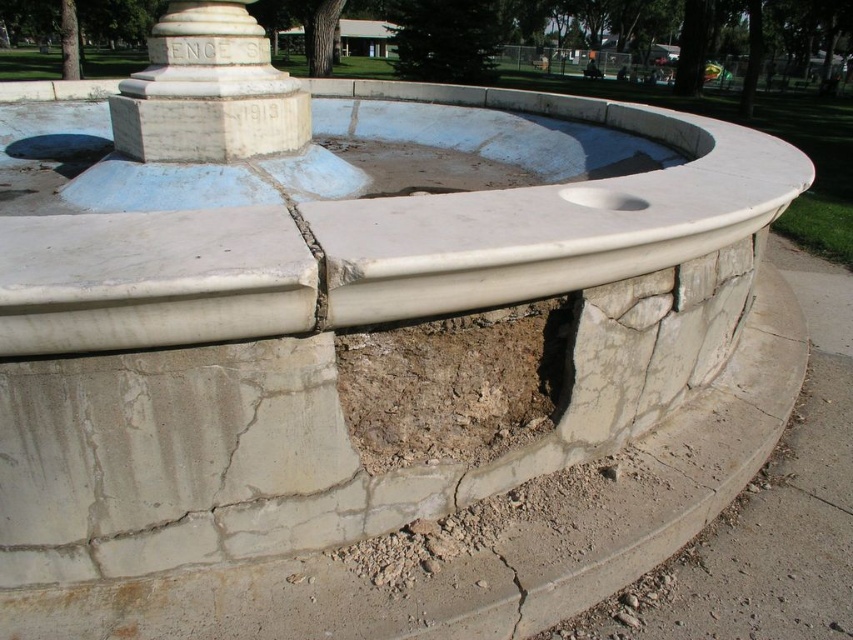
Identify the location of white stone column at center. coord(207,92).

Between point (151, 49) and point (563, 189), which one is positioned in front?

Point (563, 189)

Between point (223, 90) and point (589, 204), which one is positioned in front?

Point (589, 204)

The height and width of the screenshot is (640, 853). Identify the location of white stone column at center. (207, 92).

Is point (505, 589) farther from camera compared to point (601, 189)?

No, it is in front of (601, 189).

Does cracked concrete at lower center have a smaller size compared to smooth concrete hole at center?

No.

Where is `cracked concrete at lower center`? This screenshot has height=640, width=853. cracked concrete at lower center is located at coordinates (503, 608).

Find the location of a particular element. Image resolution: width=853 pixels, height=640 pixels. cracked concrete at lower center is located at coordinates (503, 608).

Is cracked concrete at lower center above brown dirt hole at center?

Actually, cracked concrete at lower center is below brown dirt hole at center.

Is point (496, 630) in front of point (440, 186)?

Yes, it is.

Find the location of a particular element. Image resolution: width=853 pixels, height=640 pixels. cracked concrete at lower center is located at coordinates (503, 608).